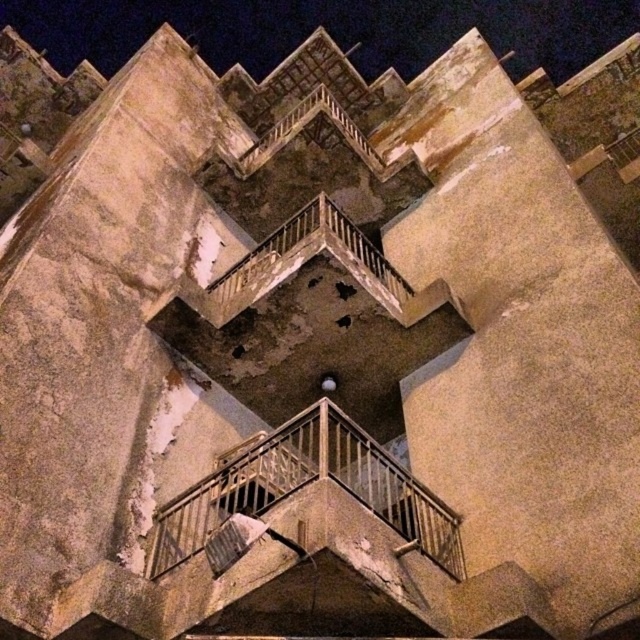
Question: Is rusty metal balcony at center thinner than rusty metal balcony at upper center?

Choices:
 (A) yes
 (B) no

Answer: (B)

Question: Can you confirm if rusty metal balcony at center is positioned to the right of rusty metal balcony at upper center?

Choices:
 (A) yes
 (B) no

Answer: (A)

Question: Does rusty metal balcony at center have a smaller size compared to rusty metal balcony at upper center?

Choices:
 (A) no
 (B) yes

Answer: (A)

Question: Which point is closer to the camera taking this photo?

Choices:
 (A) pyautogui.click(x=284, y=225)
 (B) pyautogui.click(x=330, y=422)

Answer: (B)

Question: Which of the following is the farthest from the observer?

Choices:
 (A) (288, 268)
 (B) (269, 472)

Answer: (A)

Question: Which of the following is the closest to the observer?

Choices:
 (A) (362, 241)
 (B) (376, 460)

Answer: (B)